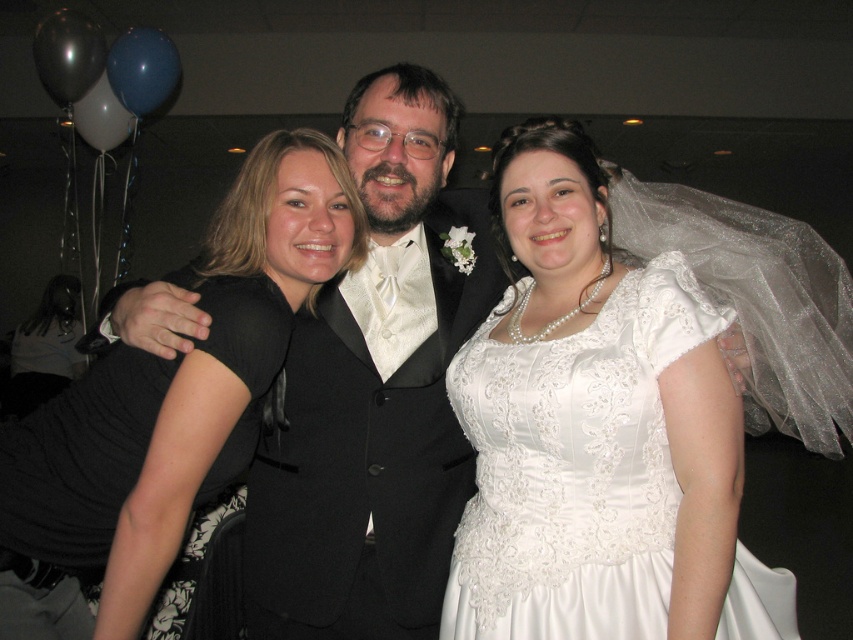
Question: Is white satin dress at center closer to camera compared to matte black suit at center?

Choices:
 (A) no
 (B) yes

Answer: (B)

Question: Which of the following is the farthest from the observer?

Choices:
 (A) (503, 333)
 (B) (149, 448)

Answer: (A)

Question: Is white satin dress at center behind matte black suit at center?

Choices:
 (A) yes
 (B) no

Answer: (B)

Question: Which point appears closest to the camera in this image?

Choices:
 (A) (680, 532)
 (B) (326, 305)

Answer: (A)

Question: Based on their relative distances, which object is nearer to the black satin dress at center?

Choices:
 (A) white satin dress at center
 (B) matte black suit at center

Answer: (B)

Question: Observing the image, what is the correct spatial positioning of matte black suit at center in reference to black satin dress at center?

Choices:
 (A) right
 (B) left

Answer: (A)